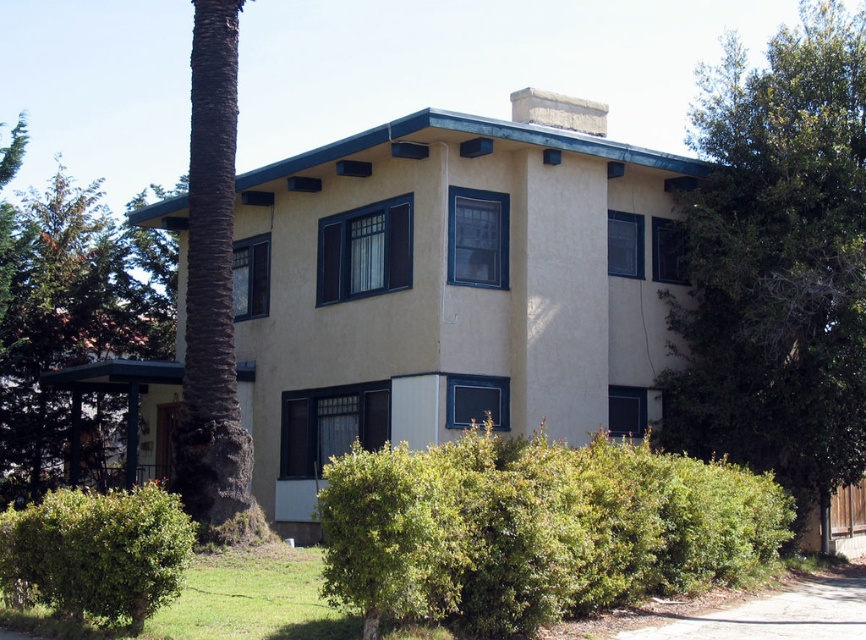
Question: Which point is closer to the camera taking this photo?

Choices:
 (A) (693, 618)
 (B) (793, 349)
 (C) (152, 564)

Answer: (C)

Question: Which object is the closest to the green leafy bush at lower left?

Choices:
 (A) green leafy bush at lower center
 (B) green leafy tree at left
 (C) dirt/gravel driveway at lower right

Answer: (A)

Question: Can you confirm if green leafy tree at right is smaller than green leafy tree at left?

Choices:
 (A) yes
 (B) no

Answer: (B)

Question: Among these objects, which one is farthest from the camera?

Choices:
 (A) green leafy bush at lower left
 (B) green leafy tree at right

Answer: (B)

Question: Is green leafy tree at left to the right of green leafy bush at lower left from the viewer's perspective?

Choices:
 (A) yes
 (B) no

Answer: (B)

Question: Is green leafy bush at lower center further to camera compared to green leafy bush at lower left?

Choices:
 (A) yes
 (B) no

Answer: (B)